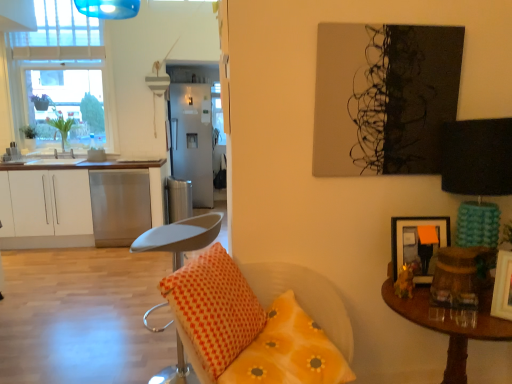
Question: Can you confirm if green leafy plant at left, placed as the 2th houseplant when sorted from left to right, is bigger than orange dotted pillow at center, the second pillow positioned from the right?

Choices:
 (A) no
 (B) yes

Answer: (A)

Question: Is green leafy plant at left, placed as the 2th houseplant when sorted from left to right, facing away from orange dotted pillow at center, the second pillow positioned from the right?

Choices:
 (A) yes
 (B) no

Answer: (B)

Question: From a real-world perspective, does green leafy plant at left, the first houseplant from the right, stand above orange dotted pillow at center, marked as the 1th pillow in a left-to-right arrangement?

Choices:
 (A) yes
 (B) no

Answer: (A)

Question: Does green leafy plant at left, placed as the 2th houseplant when sorted from left to right, appear on the left side of orange dotted pillow at center, the second pillow positioned from the right?

Choices:
 (A) no
 (B) yes

Answer: (B)

Question: Is green leafy plant at left, placed as the 2th houseplant when sorted from left to right, wider than orange dotted pillow at center, the second pillow positioned from the right?

Choices:
 (A) yes
 (B) no

Answer: (B)

Question: Does green leafy plant at left, the first houseplant from the right, turn towards orange dotted pillow at center, marked as the 1th pillow in a left-to-right arrangement?

Choices:
 (A) yes
 (B) no

Answer: (B)

Question: Is green leafy plant at left, the first houseplant from the right, thinner than brown wooden table at right?

Choices:
 (A) no
 (B) yes

Answer: (B)

Question: Can you confirm if green leafy plant at left, the first houseplant from the right, is smaller than brown wooden table at right?

Choices:
 (A) yes
 (B) no

Answer: (A)

Question: Could brown wooden table at right be considered to be inside green leafy plant at left, placed as the 2th houseplant when sorted from left to right?

Choices:
 (A) yes
 (B) no

Answer: (B)

Question: Is green leafy plant at left, placed as the 2th houseplant when sorted from left to right, facing towards brown wooden table at right?

Choices:
 (A) no
 (B) yes

Answer: (A)

Question: Is green leafy plant at left, the first houseplant from the right, closer to the viewer compared to brown wooden table at right?

Choices:
 (A) yes
 (B) no

Answer: (B)

Question: From the image's perspective, is green leafy plant at left, placed as the 2th houseplant when sorted from left to right, over brown wooden table at right?

Choices:
 (A) yes
 (B) no

Answer: (A)

Question: From the image's perspective, is satin silver trash can at center over wooden picture frame at right, which is the 1th picture frame in right-to-left order?

Choices:
 (A) no
 (B) yes

Answer: (B)